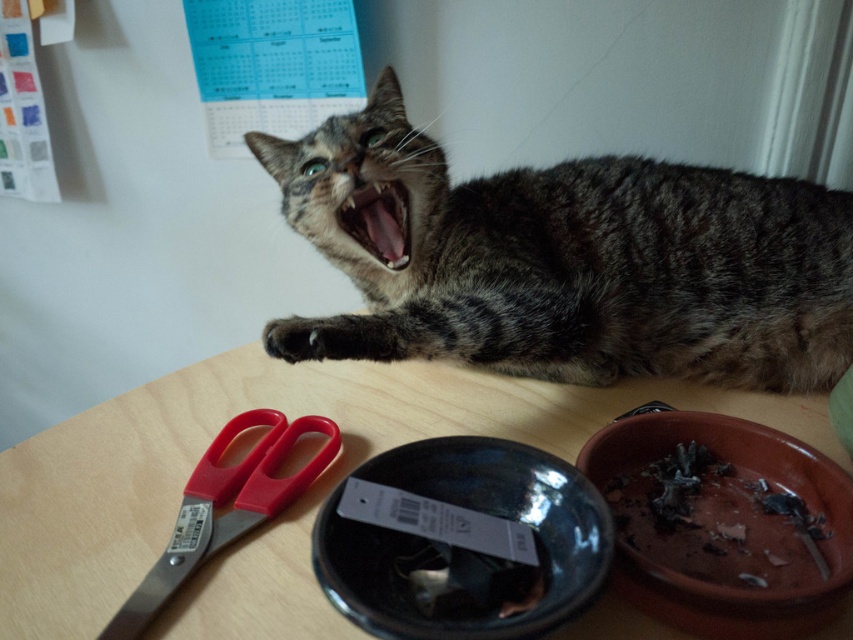
Can you confirm if red plastic scissors at lower left is positioned above smooth white teeth at center?

No, red plastic scissors at lower left is not above smooth white teeth at center.

Does red plastic scissors at lower left appear on the left side of smooth white teeth at center?

Indeed, red plastic scissors at lower left is positioned on the left side of smooth white teeth at center.

Between point (206, 492) and point (389, 259), which one is positioned behind?

The point (389, 259) is more distant.

Where is `red plastic scissors at lower left`? The image size is (853, 640). red plastic scissors at lower left is located at coordinates (225, 504).

The height and width of the screenshot is (640, 853). Describe the element at coordinates (292, 506) in the screenshot. I see `wooden table at upper center` at that location.

Which is below, wooden table at upper center or brown matte bowl at lower right?

Positioned lower is brown matte bowl at lower right.

Is point (172, 490) positioned in front of point (677, 579)?

That is False.

Where is `wooden table at upper center`? The width and height of the screenshot is (853, 640). wooden table at upper center is located at coordinates (292, 506).

Which is more to the left, tabby fur cat at upper center or brown matte bowl at lower right?

From the viewer's perspective, tabby fur cat at upper center appears more on the left side.

Is tabby fur cat at upper center to the left of brown matte bowl at lower right from the viewer's perspective?

Indeed, tabby fur cat at upper center is positioned on the left side of brown matte bowl at lower right.

Locate an element on the screen. The width and height of the screenshot is (853, 640). tabby fur cat at upper center is located at coordinates (572, 262).